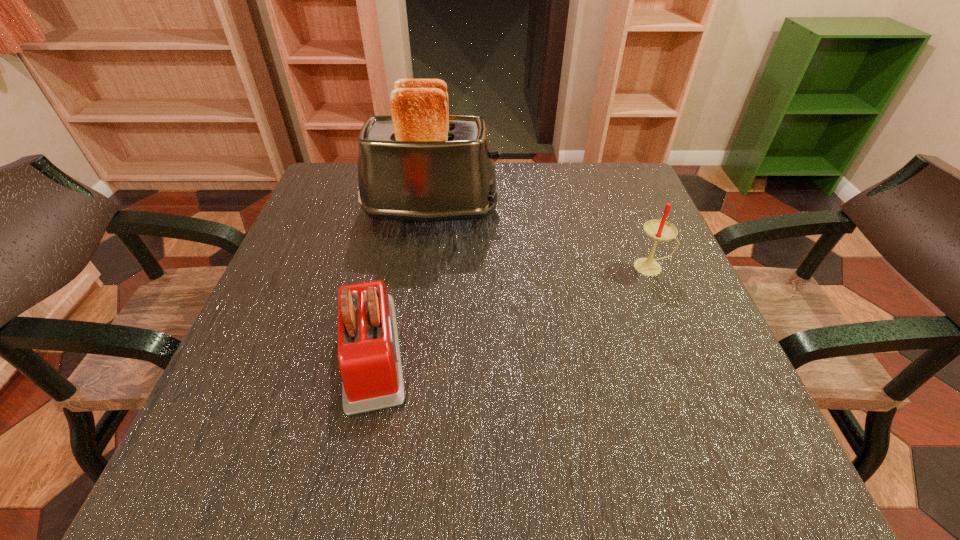
This screenshot has width=960, height=540. What are the coordinates of `object located at the right edge` in the screenshot? It's located at (660, 230).

The image size is (960, 540). Find the location of `object that is at the far left corner`. object that is at the far left corner is located at coordinates (421, 164).

In the image, there is a desktop. Identify the location of free space at the far edge. The height and width of the screenshot is (540, 960). (575, 179).

In the image, there is a desktop. Where is `vacant space at the near edge`? The image size is (960, 540). vacant space at the near edge is located at coordinates (306, 476).

Locate an element on the screen. The image size is (960, 540). free spot at the left edge of the desktop is located at coordinates (325, 325).

Locate an element on the screen. Image resolution: width=960 pixels, height=540 pixels. vacant area at the right edge is located at coordinates (619, 313).

Locate an element on the screen. This screenshot has height=540, width=960. free location at the far left corner of the desktop is located at coordinates (322, 183).

I want to click on free region at the far right corner, so click(x=591, y=208).

What are the coordinates of `free location at the near right corner of the desktop` in the screenshot? It's located at (664, 458).

Find the location of a particular element. The image size is (960, 540). vacant space that is in between the taller toaster and the nearer toaster is located at coordinates (401, 281).